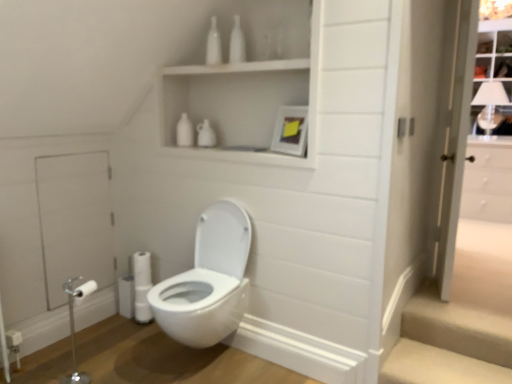
Question: Considering the relative positions of beige carpeted stairs at lower right and white glossy door at right in the image provided, is beige carpeted stairs at lower right behind white glossy door at right?

Choices:
 (A) yes
 (B) no

Answer: (A)

Question: Does beige carpeted stairs at lower right have a larger size compared to white glossy door at right?

Choices:
 (A) yes
 (B) no

Answer: (B)

Question: Is beige carpeted stairs at lower right positioned with its back to white glossy door at right?

Choices:
 (A) no
 (B) yes

Answer: (A)

Question: Is the depth of beige carpeted stairs at lower right less than that of white glossy door at right?

Choices:
 (A) no
 (B) yes

Answer: (A)

Question: Is beige carpeted stairs at lower right not near white glossy door at right?

Choices:
 (A) yes
 (B) no

Answer: (B)

Question: From the image's perspective, is white glass window at upper right located above or below beige carpeted stairs at lower right?

Choices:
 (A) above
 (B) below

Answer: (A)

Question: Considering the positions of white glass window at upper right and beige carpeted stairs at lower right in the image, is white glass window at upper right wider or thinner than beige carpeted stairs at lower right?

Choices:
 (A) thin
 (B) wide

Answer: (B)

Question: Considering the relative positions of white glass window at upper right and beige carpeted stairs at lower right in the image provided, is white glass window at upper right to the left or to the right of beige carpeted stairs at lower right?

Choices:
 (A) left
 (B) right

Answer: (B)

Question: Is point (478, 72) closer or farther from the camera than point (465, 340)?

Choices:
 (A) farther
 (B) closer

Answer: (A)

Question: From their relative heights in the image, would you say white glossy bottle at upper center, marked as the second toiletry in a right-to-left arrangement, is taller or shorter than white matte toilet paper at lower left?

Choices:
 (A) tall
 (B) short

Answer: (A)

Question: Is white glossy bottle at upper center, placed as the 1th toiletry when sorted from left to right, to the left or to the right of white matte toilet paper at lower left in the image?

Choices:
 (A) left
 (B) right

Answer: (B)

Question: Relative to white matte toilet paper at lower left, is white glossy bottle at upper center, marked as the second toiletry in a right-to-left arrangement, in front or behind?

Choices:
 (A) front
 (B) behind

Answer: (A)

Question: From the image's perspective, is white glossy bottle at upper center, placed as the 1th toiletry when sorted from left to right, positioned above or below white matte toilet paper at lower left?

Choices:
 (A) above
 (B) below

Answer: (A)

Question: In terms of width, does white glossy toilet at center look wider or thinner when compared to white glossy bottle at upper center, placed as the 1th toiletry when sorted from left to right?

Choices:
 (A) thin
 (B) wide

Answer: (B)

Question: Is white glossy toilet at center in front of or behind white glossy bottle at upper center, placed as the 1th toiletry when sorted from left to right, in the image?

Choices:
 (A) front
 (B) behind

Answer: (A)